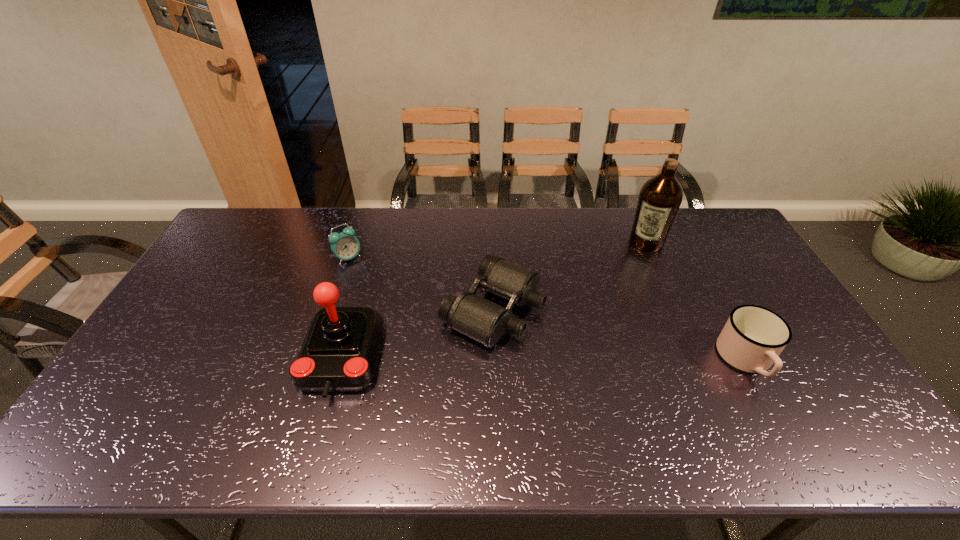
This screenshot has height=540, width=960. What are the coordinates of `vacant spot on the desktop that is between the second tallest object and the mug and is positioned on the label of the olive oil` in the screenshot? It's located at (591, 360).

What are the coordinates of `vacant space on the desktop that is between the joystick and the mug and is positioned through the eyepieces of the binoculars` in the screenshot? It's located at (604, 360).

Identify the location of free space on the desktop that is between the second tallest object and the mug and is positioned on the face of the alarm clock. The height and width of the screenshot is (540, 960). (492, 359).